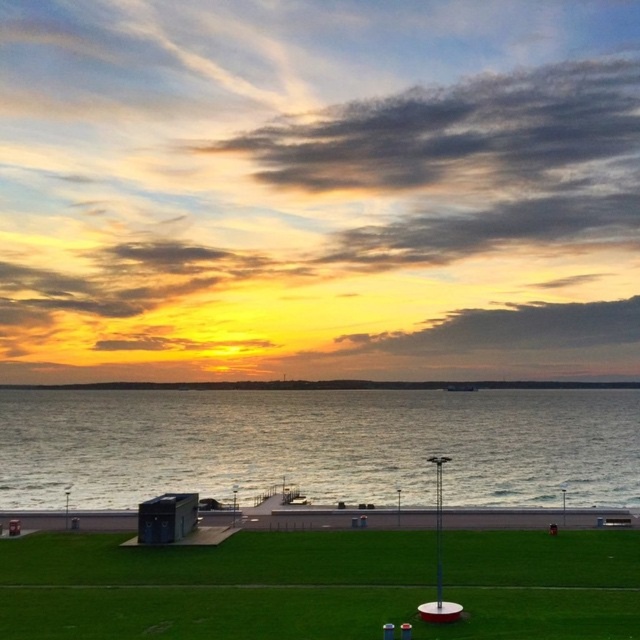
You are standing at the edge of the grassy area and want to place a small decorative statue on the ground. Which location would be more stable for the statue, the silvery reflective water at lower center or the green grass at lower center?

The green grass at lower center is more stable for placing the statue because the silvery reflective water at lower center is much taller than the green grass, indicating it might be a wet or unstable surface.

You are standing on the grassy area in the foreground of the sunset scene. There are two points marked in the image. From your perspective, which point is closer to you, point (317, 412) or point (212, 612)?

Point (317, 412) is further to the viewer than point (212, 612). Therefore, point (212, 612) is closer to you.